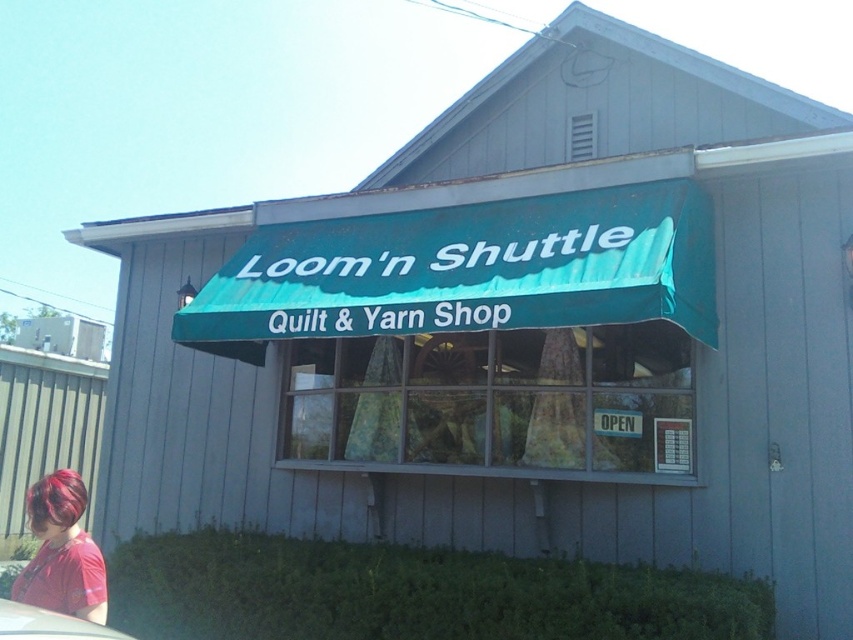
You are standing in front of the Loom n Shuttle Quilt Yarn Shop. You see the teal fabric awning at center and the shiny red hair at lower left. Which object is positioned to the right of the other?

The teal fabric awning at center is to the right of shiny red hair at lower left.

You are standing in front of the Loomn Shuttle Quilt Yarn Shop and see two points marked on its exterior. The first point is at coordinate (521,292) and the second is at (33,557). Which point is closer to you?

The point at coordinate (521,292) is closer to the viewer than the point at (33,557).